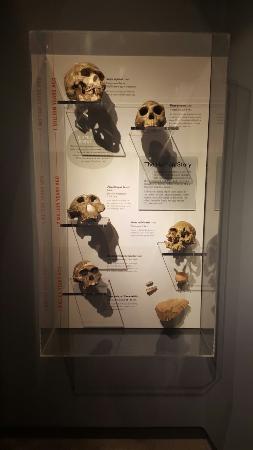
In order to click on display case in this screenshot , I will do `click(76, 349)`.